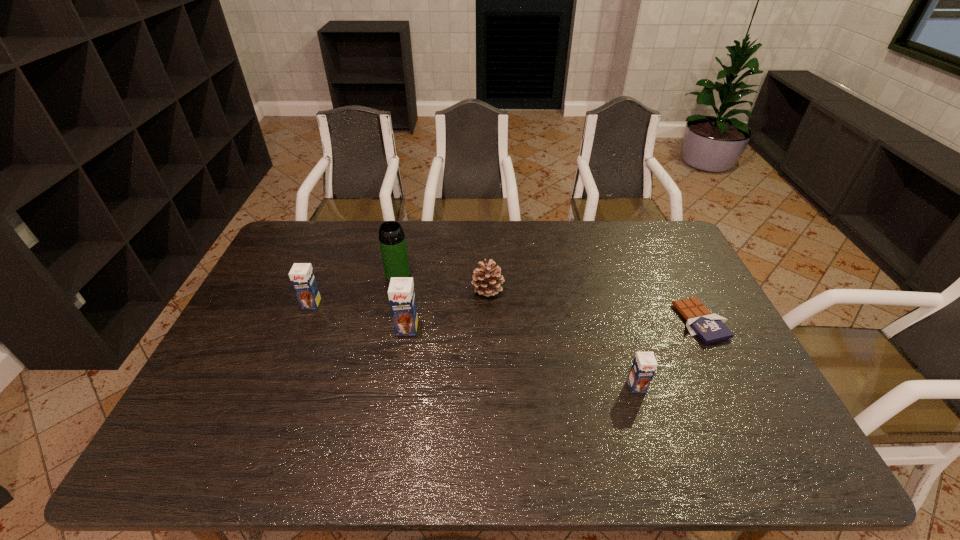
Identify the location of vacant space situated 0.280m on the front label of the second shortest chocolate milk. The height and width of the screenshot is (540, 960). coord(277,388).

Find the location of a particular element. Image resolution: width=960 pixels, height=540 pixels. vacant area located 0.240m on the front label of the second farthest chocolate milk is located at coordinates (394, 410).

The height and width of the screenshot is (540, 960). I want to click on vacant region located 0.060m on the front label of the fifth object from left to right, so click(x=645, y=414).

This screenshot has height=540, width=960. What are the coordinates of `free region located on the front of the shortest object` in the screenshot? It's located at (726, 369).

At what (x,y) coordinates should I click in order to perform the action: click on free region located 0.130m on the left of the fourth object from left to right. Please return your answer as a coordinate pair (x, y). Looking at the image, I should click on (431, 289).

In order to click on vacant space located 0.280m from the spout of the thermos bottle in this screenshot , I will do `click(381, 349)`.

At what (x,y) coordinates should I click in order to perform the action: click on object that is at the right edge. Please return your answer as a coordinate pair (x, y). The height and width of the screenshot is (540, 960). Looking at the image, I should click on (709, 327).

You are a GUI agent. You are given a task and a screenshot of the screen. Output one action in this format:
    pyautogui.click(x=<x>, y=<y>)
    Task: Click on the free space at the far edge
    
    Given the screenshot: What is the action you would take?
    pyautogui.click(x=517, y=240)

This screenshot has height=540, width=960. Find the location of `free space at the near edge of the desktop`. free space at the near edge of the desktop is located at coordinates (628, 415).

Locate an element on the screen. The image size is (960, 540). free space at the left edge of the desktop is located at coordinates (296, 262).